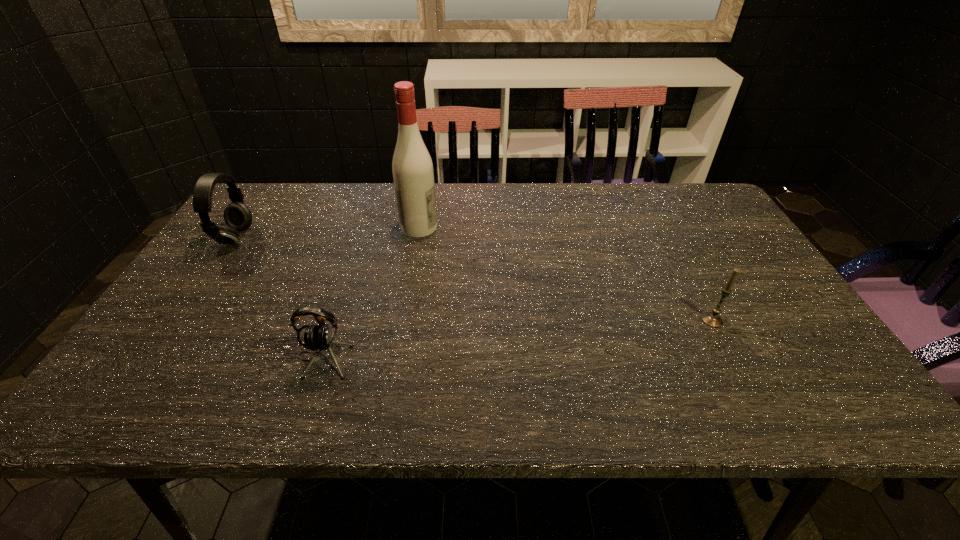
Image resolution: width=960 pixels, height=540 pixels. I want to click on vacant space situated on the left of the shorter earphone, so click(195, 357).

Image resolution: width=960 pixels, height=540 pixels. I want to click on free space located 0.180m on the back of the candle, so click(683, 264).

The height and width of the screenshot is (540, 960). In order to click on alcohol located in the far edge section of the desktop in this screenshot , I will do click(412, 168).

I want to click on earphone at the far edge, so click(237, 216).

In order to click on object positioned at the near edge in this screenshot , I will do `click(320, 337)`.

You are a GUI agent. You are given a task and a screenshot of the screen. Output one action in this format:
    pyautogui.click(x=<x>, y=<y>)
    Task: Click on the object present at the left edge
    The height and width of the screenshot is (540, 960).
    Given the screenshot: What is the action you would take?
    pyautogui.click(x=237, y=216)

At what (x,y) coordinates should I click in order to perform the action: click on object that is at the far left corner. Please return your answer as a coordinate pair (x, y). The image size is (960, 540). Looking at the image, I should click on (237, 216).

Image resolution: width=960 pixels, height=540 pixels. Identify the location of vacant space at the far edge of the desktop. (393, 192).

Find the location of a particular element. vacant region at the near edge of the desktop is located at coordinates (409, 396).

In order to click on vacant area at the left edge of the desktop in this screenshot , I will do `click(267, 237)`.